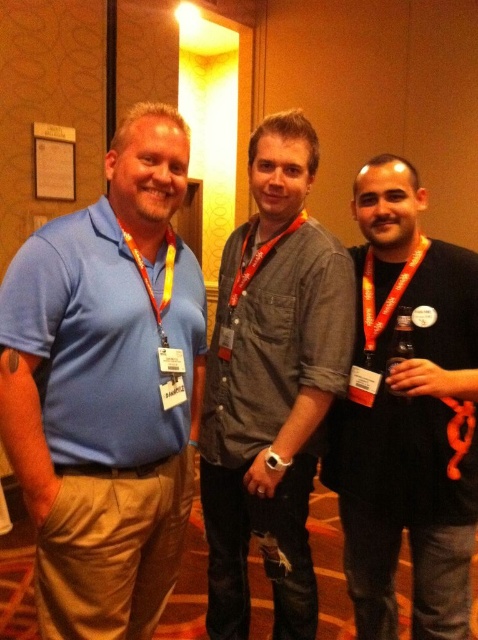
You are attending a conference and want to take a photo of the two points mentioned in the scene. Which point is closer to the camera, point (260, 262) or point (280, 208)?

Point (280, 208) is closer to the camera because the description states that point (260, 262) is further away.

You are a photographer at a conference and need to position two subjects for a photo. The subjects are the black matte shirt at right and the matte black lanyard at center. According to the scene, which subject is positioned to the right of the other?

The black matte shirt at right is positioned to the right of the matte black lanyard at center.